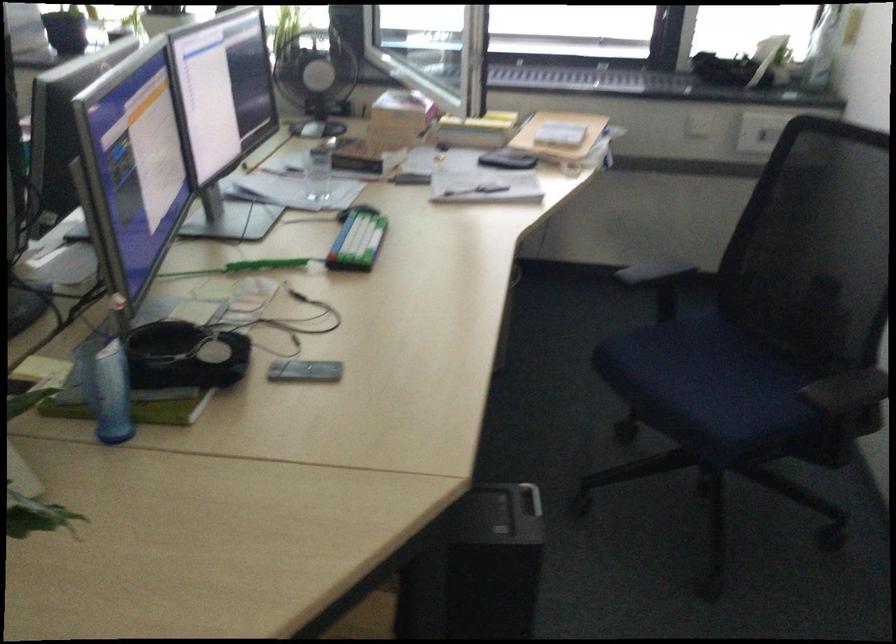
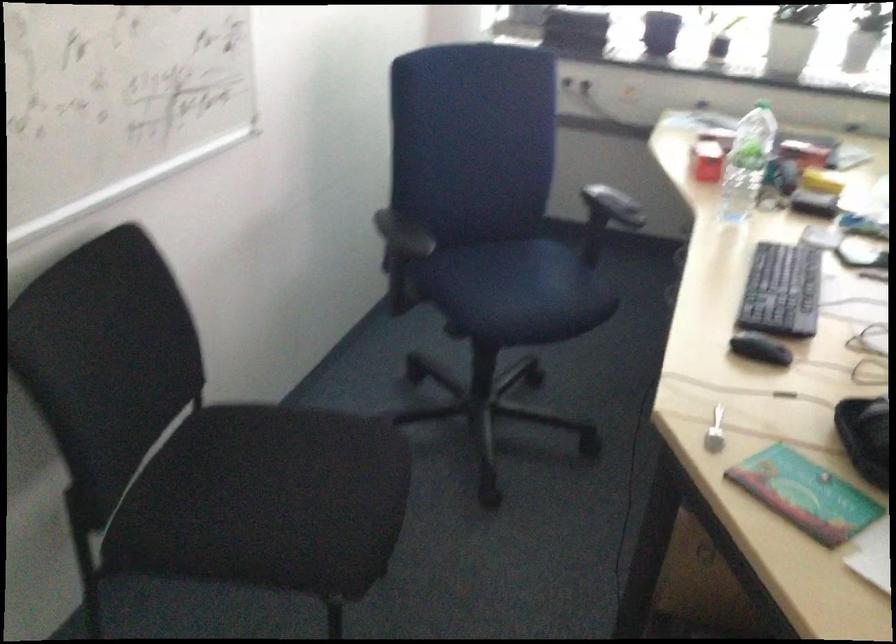
Question: What movement of the cameraman would produce the second image?

Choices:
 (A) Left
 (B) Right
 (C) Forward
 (D) Backward

Answer: (A)